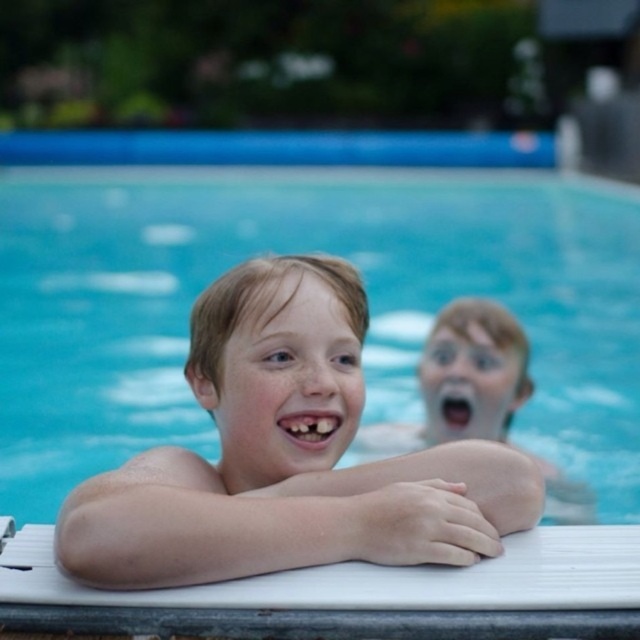
Question: Which object is farther from the camera taking this photo?

Choices:
 (A) smooth skin boy at center
 (B) smooth skin child at center

Answer: (B)

Question: Where is smooth skin boy at center located in relation to smooth skin child at center in the image?

Choices:
 (A) above
 (B) below

Answer: (A)

Question: Which point appears closest to the camera in this image?

Choices:
 (A) (170, 484)
 (B) (448, 364)

Answer: (A)

Question: Does smooth skin boy at center appear on the right side of smooth skin child at center?

Choices:
 (A) yes
 (B) no

Answer: (B)

Question: Does smooth skin boy at center have a smaller size compared to smooth skin child at center?

Choices:
 (A) yes
 (B) no

Answer: (A)